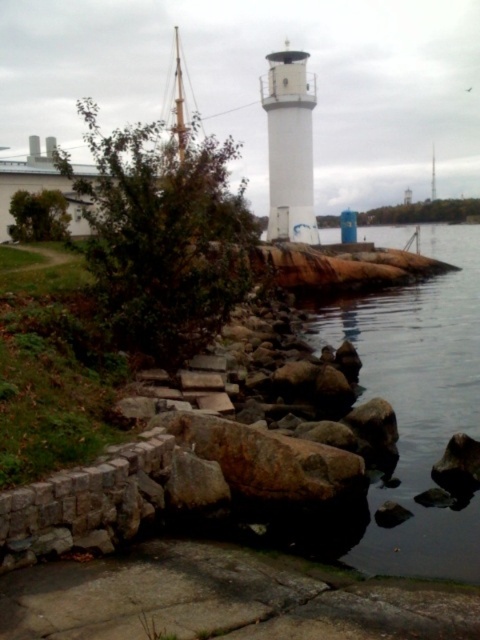
Does rockyrough stonerocks at lower center have a lesser height compared to smooth rock lake at center?

Yes, rockyrough stonerocks at lower center is shorter than smooth rock lake at center.

Does rockyrough stonerocks at lower center have a smaller size compared to smooth rock lake at center?

Yes.

Find the location of a particular element. The width and height of the screenshot is (480, 640). rockyrough stonerocks at lower center is located at coordinates (225, 458).

At what (x,y) coordinates should I click in order to perform the action: click on rockyrough stonerocks at lower center. Please return your answer as a coordinate pair (x, y). The image size is (480, 640). Looking at the image, I should click on (225, 458).

Is rockyrough stonerocks at lower center to the left of white smooth lighthouse at center from the viewer's perspective?

Indeed, rockyrough stonerocks at lower center is positioned on the left side of white smooth lighthouse at center.

Who is more forward, (250, 433) or (296, 74)?

Point (250, 433) is more forward.

Find the location of a particular element. The image size is (480, 640). rockyrough stonerocks at lower center is located at coordinates (225, 458).

Is smooth rock lake at center positioned in front of white smooth lighthouse at center?

Yes, smooth rock lake at center is closer to the viewer.

Does smooth rock lake at center appear on the right side of white smooth lighthouse at center?

Indeed, smooth rock lake at center is positioned on the right side of white smooth lighthouse at center.

Which is in front, point (457, 312) or point (286, 202)?

Positioned in front is point (457, 312).

Locate an element on the screen. The height and width of the screenshot is (640, 480). smooth rock lake at center is located at coordinates (419, 401).